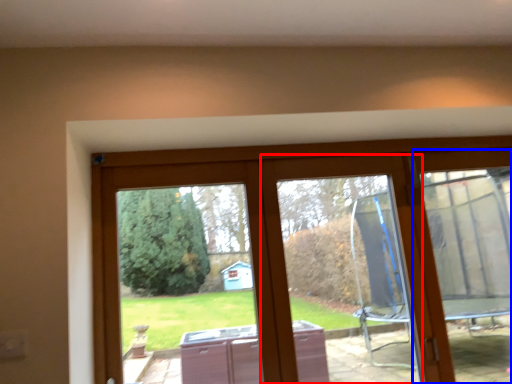
Question: Which object appears farthest to the camera in this image, window frame (highlighted by a red box) or screen door (highlighted by a blue box)?

Choices:
 (A) window frame
 (B) screen door

Answer: (B)